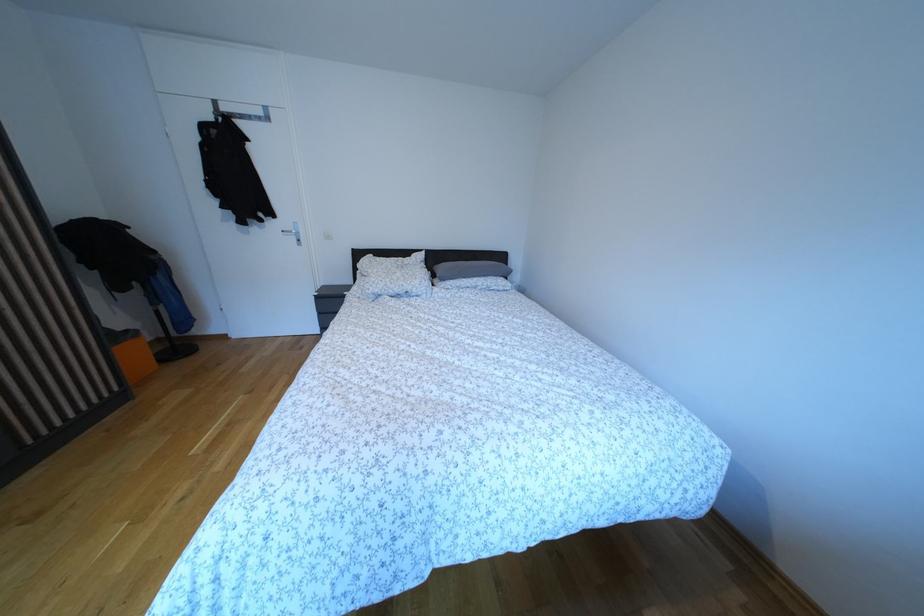
The width and height of the screenshot is (924, 616). What do you see at coordinates (327, 235) in the screenshot?
I see `the white light switch` at bounding box center [327, 235].